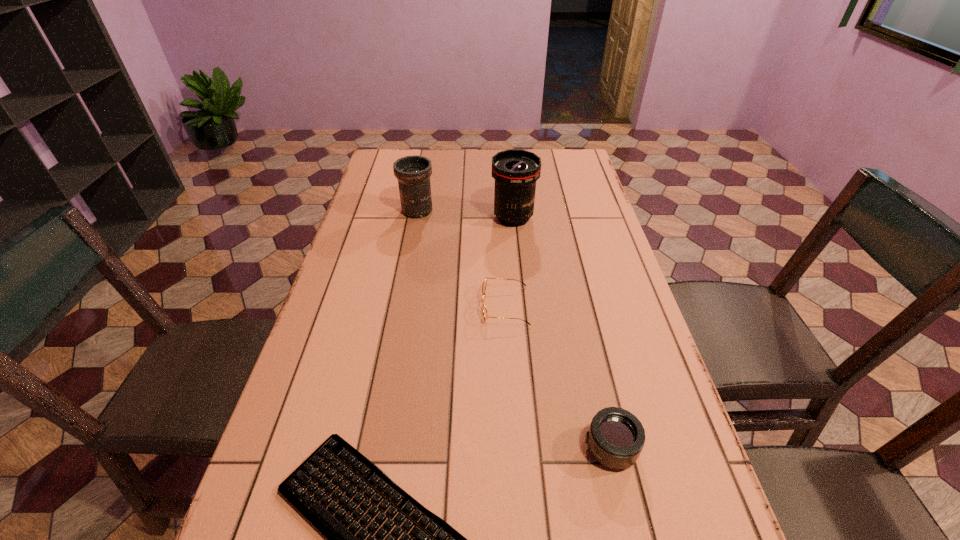
In the image, there is a desktop. Where is `vacant space at the right edge`? This screenshot has width=960, height=540. vacant space at the right edge is located at coordinates (588, 220).

Image resolution: width=960 pixels, height=540 pixels. What are the coordinates of `free space at the far left corner of the desktop` in the screenshot? It's located at (390, 164).

Find the location of a particular element. The height and width of the screenshot is (540, 960). free region at the far right corner of the desktop is located at coordinates (587, 177).

The height and width of the screenshot is (540, 960). Find the location of `free space between the tallest object and the second tallest telephoto lens`. free space between the tallest object and the second tallest telephoto lens is located at coordinates (466, 214).

Identify the location of vacant area that lies between the tallest telephoto lens and the spectacles. (509, 262).

Identify the location of blank region between the rightmost telephoto lens and the spectacles. Image resolution: width=960 pixels, height=540 pixels. (558, 376).

Locate an element on the screen. The image size is (960, 540). vacant area between the rightmost object and the spectacles is located at coordinates (558, 376).

In order to click on free space that is in between the third farthest object and the third shortest object in this screenshot , I will do `click(558, 376)`.

The width and height of the screenshot is (960, 540). In order to click on empty location between the leftmost telephoto lens and the fourth tallest object in this screenshot , I will do `click(462, 258)`.

The height and width of the screenshot is (540, 960). In order to click on object that is the second closest one to the second shortest object in this screenshot , I will do `click(616, 437)`.